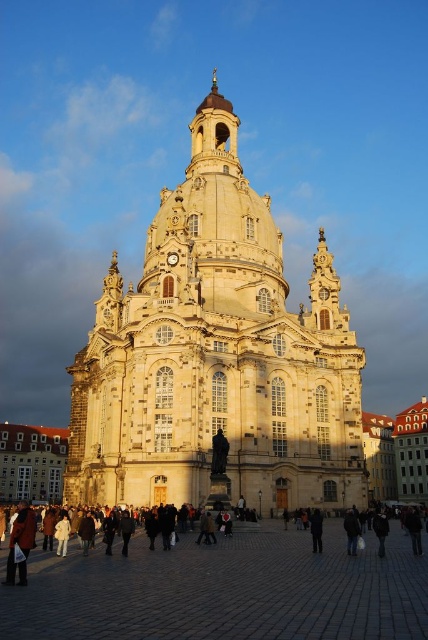
Question: Can you confirm if leather jacket at lower left is positioned below dark gray fabric at center?

Choices:
 (A) yes
 (B) no

Answer: (A)

Question: Is brown cobblestone at center positioned behind dark brown leather jacket at lower right?

Choices:
 (A) no
 (B) yes

Answer: (A)

Question: Which of the following is the farthest from the observer?

Choices:
 (A) brown cobblestone at center
 (B) dark brown leather jacket at lower right
 (C) stone textured church at center

Answer: (C)

Question: Among these points, which one is farthest from the camera?

Choices:
 (A) (23, 540)
 (B) (264, 333)
 (C) (261, 592)
 (D) (312, 550)

Answer: (B)

Question: Which of the following is the farthest from the observer?

Choices:
 (A) (32, 564)
 (B) (315, 509)

Answer: (B)

Question: Does stone textured church at center have a lesser width compared to brown cobblestone at center?

Choices:
 (A) no
 (B) yes

Answer: (A)